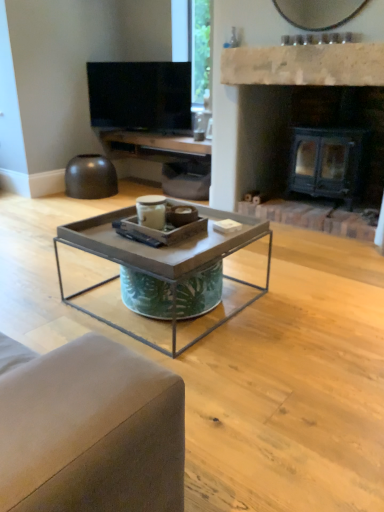
Find the location of a particular element. The width and height of the screenshot is (384, 512). free spot to the right of metal/texturedcoffee table at center is located at coordinates (304, 302).